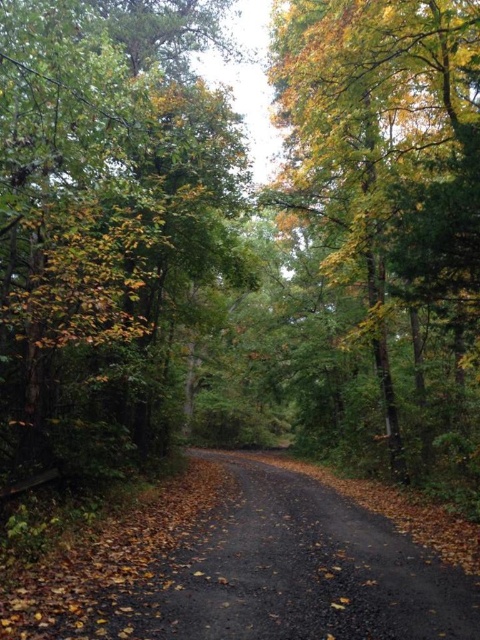
Question: Which point is closer to the camera?

Choices:
 (A) green leafy tree at upper right
 (B) black asphalt road at center

Answer: (B)

Question: Is green leafy tree at upper right in front of black asphalt road at center?

Choices:
 (A) no
 (B) yes

Answer: (A)

Question: Which object appears farthest from the camera in this image?

Choices:
 (A) green leafy tree at upper right
 (B) green matte tree at center

Answer: (A)

Question: Is green matte tree at center wider than green leafy tree at upper right?

Choices:
 (A) yes
 (B) no

Answer: (B)

Question: Where is green matte tree at center located in relation to green leafy tree at upper right in the image?

Choices:
 (A) left
 (B) right

Answer: (A)

Question: Which point is closer to the camera taking this photo?

Choices:
 (A) (350, 68)
 (B) (311, 496)

Answer: (A)